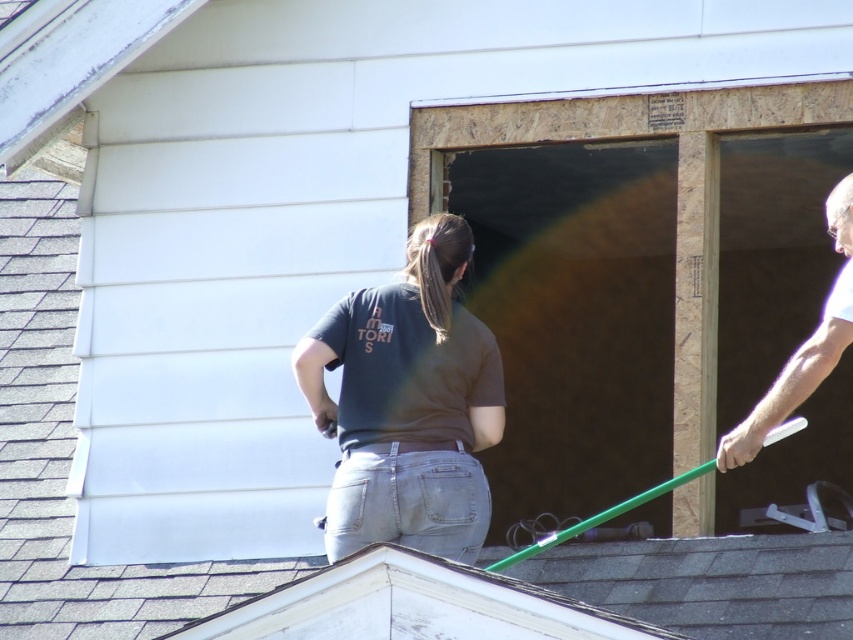
Based on the photo, you are a safety inspector reviewing this construction site. You notice a point at coordinates (408, 404). What object or clothing item is located at that point?

The point at (408, 404) corresponds to the dark gray t shirt at center.